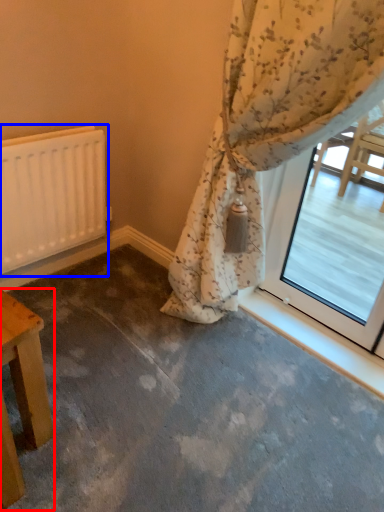
Question: Which of the following is the farthest to the observer, table (highlighted by a red box) or radiator (highlighted by a blue box)?

Choices:
 (A) table
 (B) radiator

Answer: (B)